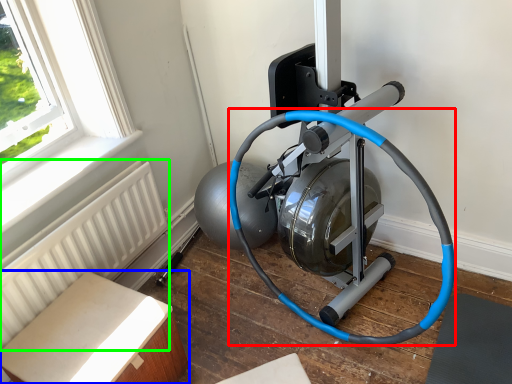
Question: Estimate the real-world distances between objects in this image. Which object is closer to garden hose (highlighted by a red box), furniture (highlighted by a blue box) or radiator (highlighted by a green box)?

Choices:
 (A) furniture
 (B) radiator

Answer: (B)